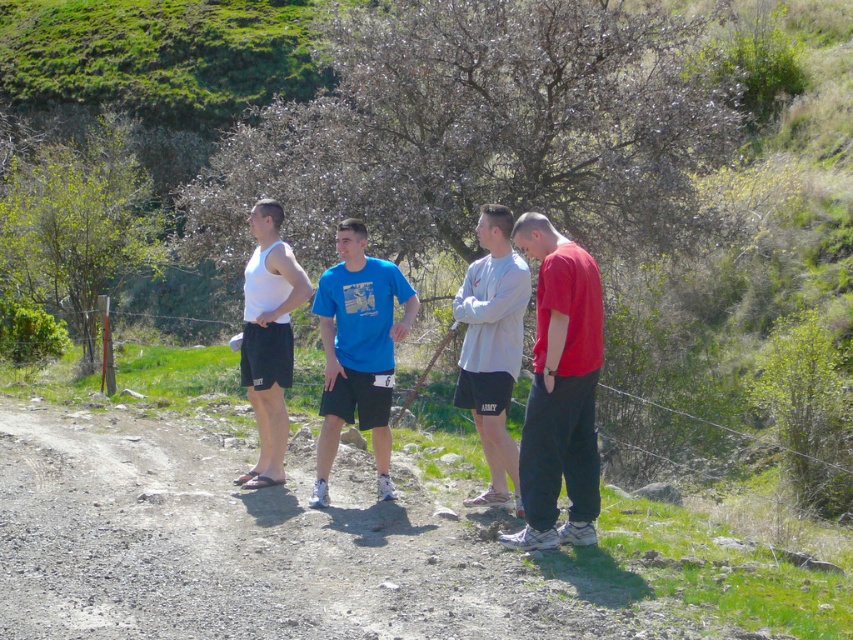
You are standing at the origin of a coordinate system placed at the bottom left corner of the image. You see a gray matte shorts at center located at point (492, 348). If you move 0.1 units to the right along the x axis, will you be closer to or farther from the gray matte shorts at center?

Moving 0.1 units to the right along the x axis would increase your x coordinate by 0.1, making your new position farther from the gray matte shorts at center located at (492, 348) since the original x coordinate of the shorts is 0.544. Moving right past that point would create greater distance.

You are organizing a clothing sale and need to categorize items by size. You have two items from the image to sort into small, medium, or large. The gray matte shorts at center and the white matte tank top at center. Based on their widths, which one should be placed in a smaller size category?

The gray matte shorts at center has a smaller width than the white matte tank top at center, so the gray matte shorts at center should be placed in a smaller size category.

From the picture: You are navigating a dirt path in a rural area and see two points marked on the map. The first point is at coordinate point (367, 308) and the second is at point (260, 348). If you are facing north, which point is closer to your current position?

The point at (260, 348) is closer to your current position because it is behind point (367, 308), meaning point (367, 308) is further away from you.